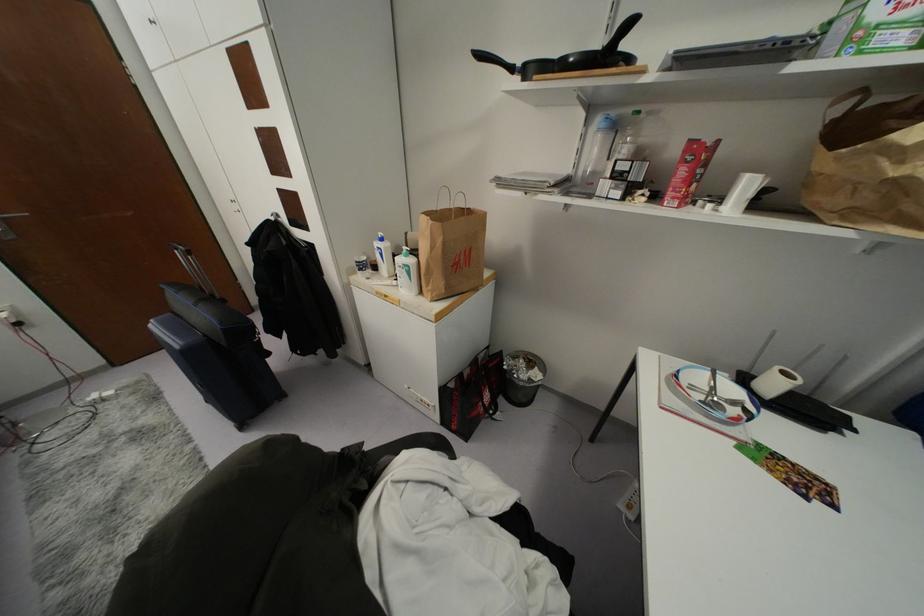
The image size is (924, 616). What do you see at coordinates (13, 213) in the screenshot? I see `the silver door handle` at bounding box center [13, 213].